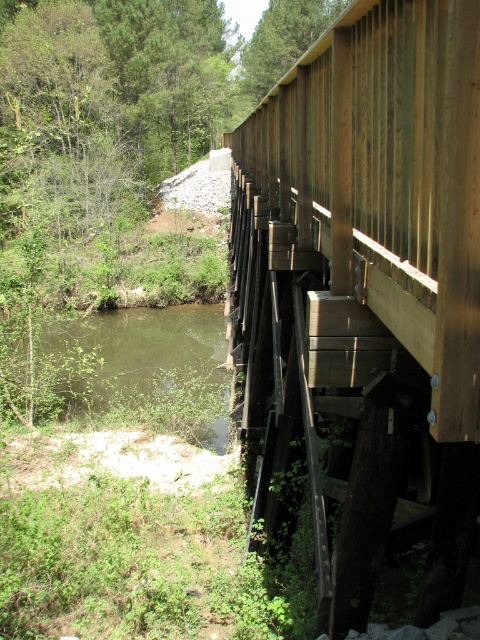
Who is positioned more to the right, wooden bridge at right or green murky water at lower left?

wooden bridge at right

Can you confirm if wooden bridge at right is wider than green murky water at lower left?

No.

Based on the photo, who is more forward, (467, 342) or (136, 396)?

Point (467, 342) is more forward.

At what (x,y) coordinates should I click in order to perform the action: click on wooden bridge at right. Please return your answer as a coordinate pair (x, y). The width and height of the screenshot is (480, 640). Looking at the image, I should click on coord(364,292).